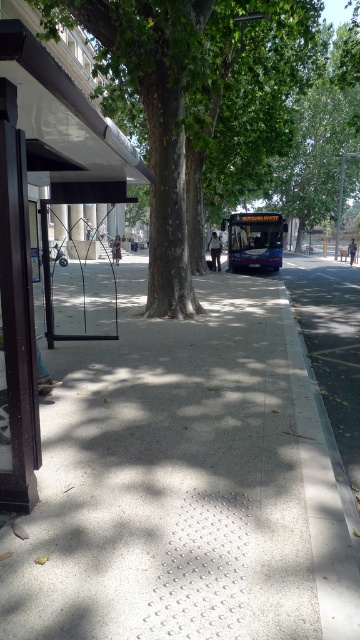
Is gray concrete curb at lower right taller than blue metallic bus at center?

In fact, gray concrete curb at lower right may be shorter than blue metallic bus at center.

I want to click on gray concrete curb at lower right, so click(324, 493).

Which is behind, point (338, 520) or point (245, 220)?

The point (245, 220) is more distant.

Image resolution: width=360 pixels, height=640 pixels. Find the location of `gray concrete curb at lower right`. gray concrete curb at lower right is located at coordinates (324, 493).

Does black matte bus stop at left come in front of gray concrete curb at lower right?

No, black matte bus stop at left is behind gray concrete curb at lower right.

Can you confirm if black matte bus stop at left is shorter than gray concrete curb at lower right?

Incorrect, black matte bus stop at left's height does not fall short of gray concrete curb at lower right's.

Does point (5, 104) come farther from viewer compared to point (313, 480)?

No, it is in front of (313, 480).

You are a GUI agent. You are given a task and a screenshot of the screen. Output one action in this format:
    pyautogui.click(x=<x>, y=<y>)
    Task: Click on the black matte bus stop at left
    This screenshot has width=360, height=640.
    Given the screenshot: What is the action you would take?
    point(28,220)

Can you confirm if green leafy tree at center is taller than gray concrete curb at lower right?

Yes, green leafy tree at center is taller than gray concrete curb at lower right.

How much distance is there between green leafy tree at center and gray concrete curb at lower right?

10.37 meters

Is point (234, 132) farther from viewer compared to point (324, 488)?

That is True.

Identify the location of green leafy tree at center. The width and height of the screenshot is (360, 640). (178, 96).